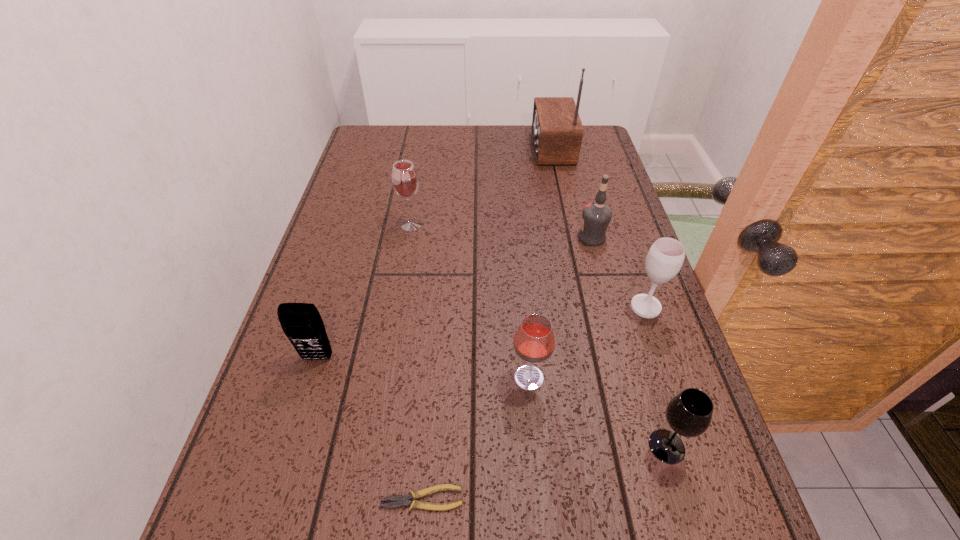
Identify the location of blank space located 0.150m on the screen of the leftmost object. This screenshot has height=540, width=960. (294, 437).

Image resolution: width=960 pixels, height=540 pixels. Identify the location of free location located on the left of the nearest wineglass. (545, 446).

You are a GUI agent. You are given a task and a screenshot of the screen. Output one action in this format:
    pyautogui.click(x=<x>, y=<y>)
    Task: Click on the free space located 0.380m on the right of the shortest object
    The image size is (960, 540).
    Given the screenshot: What is the action you would take?
    coord(698,498)

What are the coordinates of `object that is positioned at the far edge` in the screenshot? It's located at (557, 131).

Identify the location of object that is positioned at the left edge. This screenshot has height=540, width=960. (301, 322).

Locate an element on the screen. radio receiver at the right edge is located at coordinates (557, 131).

The image size is (960, 540). Identify the location of vodka located at the right edge. (596, 216).

The image size is (960, 540). I want to click on object situated at the far right corner, so click(x=557, y=131).

At what (x,y) coordinates should I click in order to perform the action: click on free region at the far edge of the desktop. Please return your answer as a coordinate pair (x, y). Looking at the image, I should click on (513, 137).

In the image, there is a desktop. Identify the location of free space at the left edge. Image resolution: width=960 pixels, height=540 pixels. (337, 292).